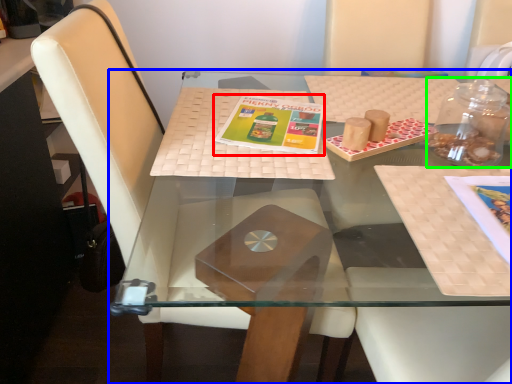
Question: Estimate the real-world distances between objects in this image. Which object is farther from book cover (highlighted by a red box), table (highlighted by a blue box) or glass jar (highlighted by a green box)?

Choices:
 (A) table
 (B) glass jar

Answer: (B)